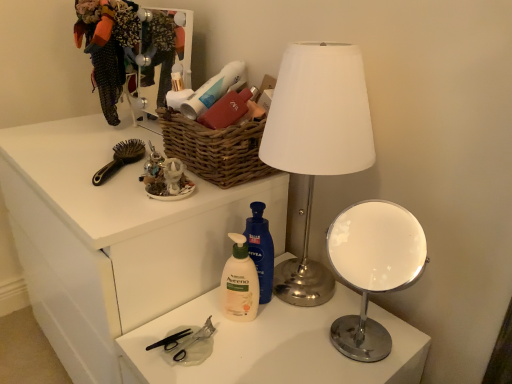
Image resolution: width=512 pixels, height=384 pixels. I want to click on empty space that is to the right of white plastic pump bottle at center, the 2th cleaning product viewed from the left, so click(332, 327).